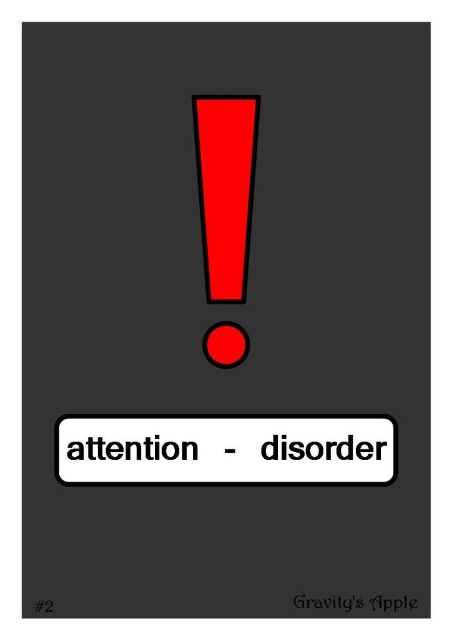
Question: Does white matte rectangle at center have a smaller size compared to matte black circle at center?

Choices:
 (A) no
 (B) yes

Answer: (A)

Question: Does white matte rectangle at center have a larger size compared to matte black circle at center?

Choices:
 (A) no
 (B) yes

Answer: (B)

Question: Among these points, which one is farthest from the camera?

Choices:
 (A) (239, 355)
 (B) (109, 477)

Answer: (A)

Question: Does white matte rectangle at center appear under matte black circle at center?

Choices:
 (A) yes
 (B) no

Answer: (A)

Question: Among these points, which one is nearest to the camera?

Choices:
 (A) (213, 356)
 (B) (158, 445)

Answer: (B)